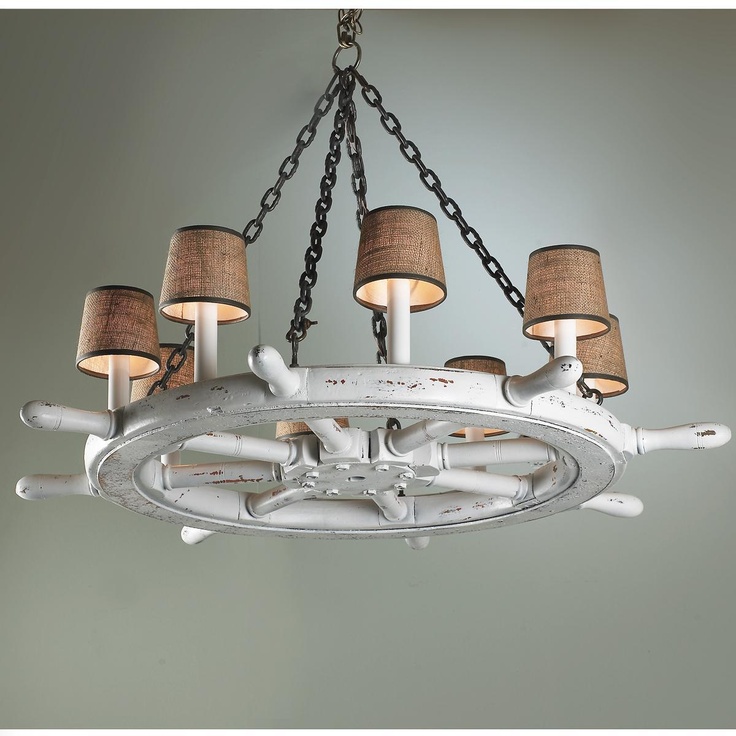
Identify the location of light. This screenshot has height=736, width=736. (144, 367), (229, 308), (419, 297), (581, 322), (603, 388).